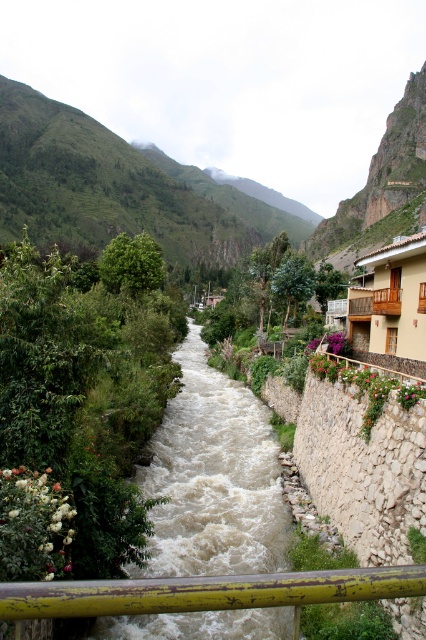
You are standing at a viewpoint overlooking the mountain valley and river. You notice a specific point marked at coordinates point (261, 408). If you want to throw a pebble to hit that exact point, considering the distance, would you need to throw it with a strong force or can you do it with a gentle toss?

The point (261, 408) is 140.90 feet away from you. Since this distance is quite far, you would need to throw the pebble with a strong force to reach it.

Consider the image. You are a hiker planning to cross the river using a narrow wooden bridge that is not visible in the image. You notice the white frothy water at center and the green grassy mountain at upper left. Based on their positions, which object would you prioritize checking for safety before crossing?

You should prioritize checking the white frothy water at center because it is closer to the viewer, indicating it is nearer to the crossing point, so its conditions are more immediately relevant to your safety.